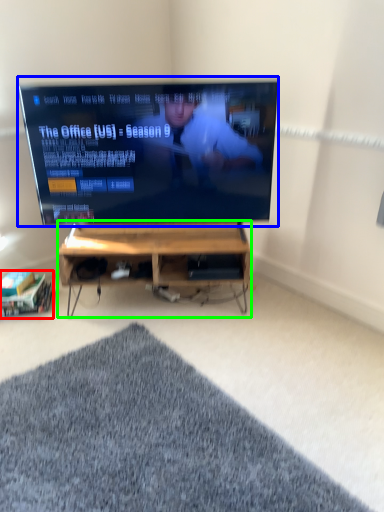
Question: Considering the real-world distances, which object is closest to shelf (highlighted by a red box)? television (highlighted by a blue box) or desk (highlighted by a green box).

Choices:
 (A) television
 (B) desk

Answer: (B)